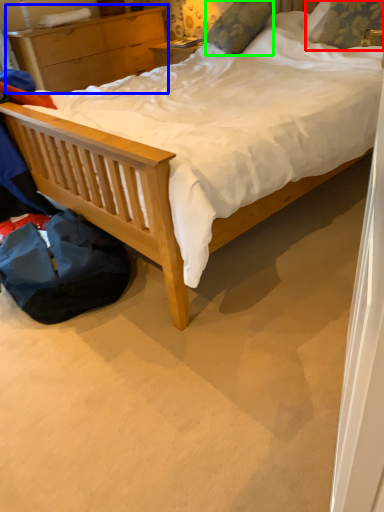
Question: Considering the real-world distances, which object is farthest from pillow (highlighted by a red box)? nightstand (highlighted by a blue box) or pillow (highlighted by a green box)?

Choices:
 (A) nightstand
 (B) pillow

Answer: (A)